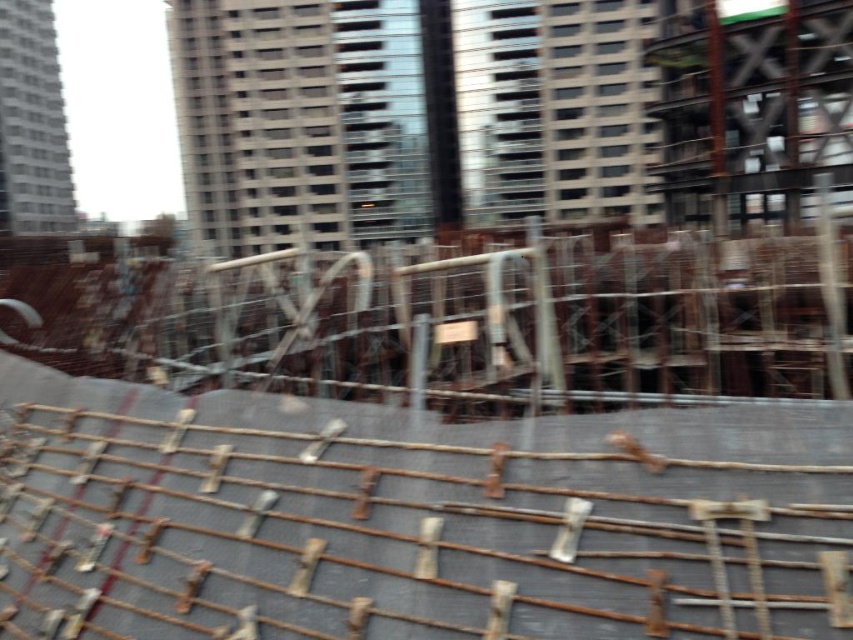
You are a construction worker assessing the materials on site. You see the rusty metal rebar at center and the rusty metal fence at center. Which object is shorter?

The rusty metal rebar at center is shorter than the rusty metal fence at center.

You are a construction worker standing at the edge of the construction site. You need to place a new tool on the ground between the rusty metal rebar at center and the rusty metal fence at center. Which object should you place the tool closer to in order to keep it above the ground?

The rusty metal fence at center is above the rusty metal rebar at center. To keep the tool above the ground, place it closer to the rusty metal fence at center.